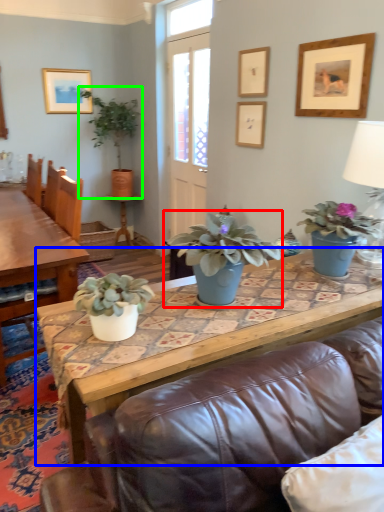
Question: Which is nearer to the houseplant (highlighted by a red box)? coffee table (highlighted by a blue box) or houseplant (highlighted by a green box).

Choices:
 (A) coffee table
 (B) houseplant

Answer: (A)